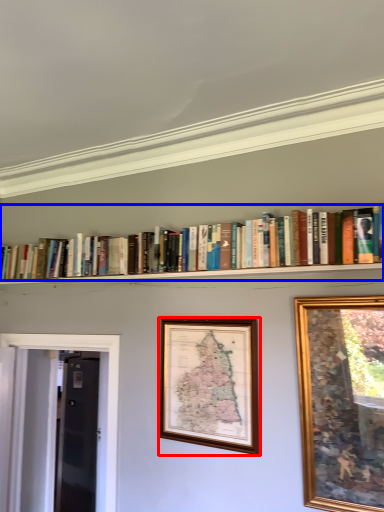
Question: Which point is closer to the camera, picture frame (highlighted by a red box) or book (highlighted by a blue box)?

Choices:
 (A) picture frame
 (B) book

Answer: (B)